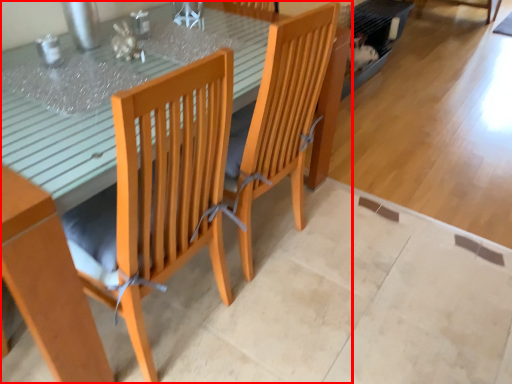
Question: Considering the relative positions of table (annotated by the red box) and chair in the image provided, where is table (annotated by the red box) located with respect to the staircase?

Choices:
 (A) left
 (B) right

Answer: (A)